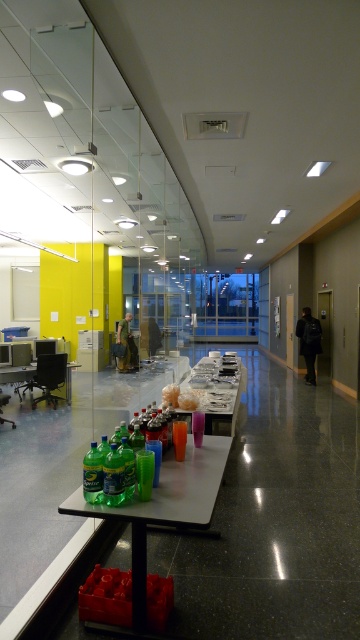
Question: Can you confirm if translucent plastic table at lower center is positioned below green plastic table at lower left?

Choices:
 (A) yes
 (B) no

Answer: (A)

Question: Which point is closer to the camera?

Choices:
 (A) translucent plastic table at lower center
 (B) green plastic table at lower left
 (C) white glossy table at center

Answer: (A)

Question: Can you confirm if white glossy table at center is positioned to the left of green plastic table at lower left?

Choices:
 (A) yes
 (B) no

Answer: (B)

Question: Which of these objects is positioned farthest from the translucent plastic table at lower center?

Choices:
 (A) white glossy table at center
 (B) green plastic table at lower left

Answer: (B)

Question: Is translucent plastic table at lower center below white glossy table at center?

Choices:
 (A) yes
 (B) no

Answer: (A)

Question: Among these points, which one is farthest from the camera?

Choices:
 (A) (245, 380)
 (B) (19, 372)

Answer: (A)